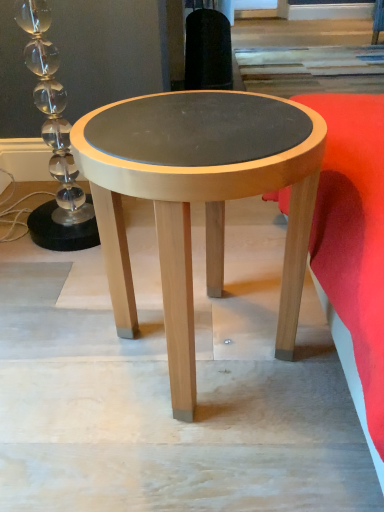
You are a GUI agent. You are given a task and a screenshot of the screen. Output one action in this format:
    pyautogui.click(x=<x>, y=<y>)
    Task: Click on the vacant space that is to the left of matte wood coffee table at center
    
    Given the screenshot: What is the action you would take?
    [55, 342]